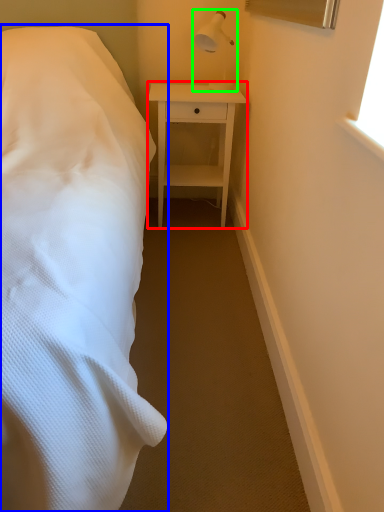
Question: Estimate the real-world distances between objects in this image. Which object is closer to nightstand (highlighted by a red box), bed (highlighted by a blue box) or bedside lamp (highlighted by a green box)?

Choices:
 (A) bed
 (B) bedside lamp

Answer: (B)